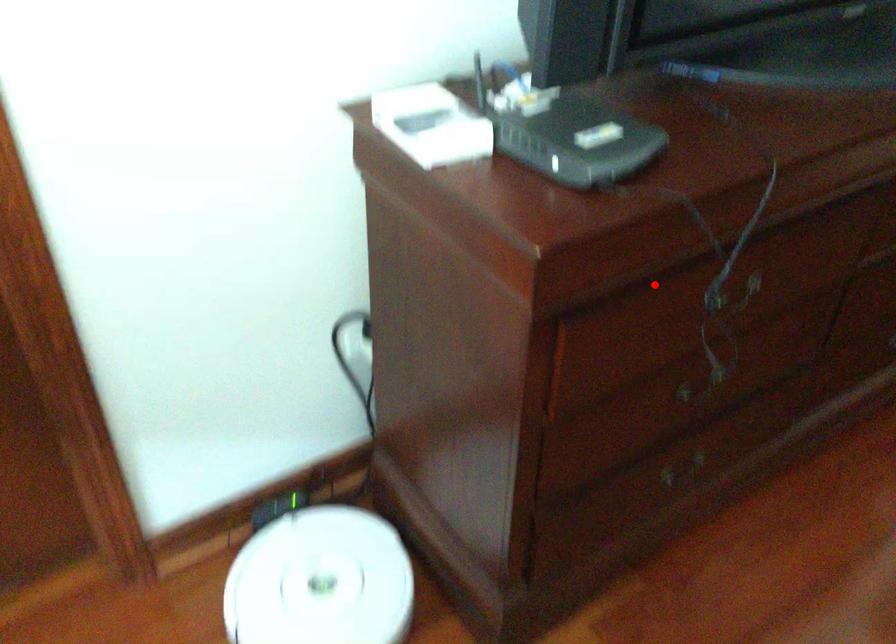
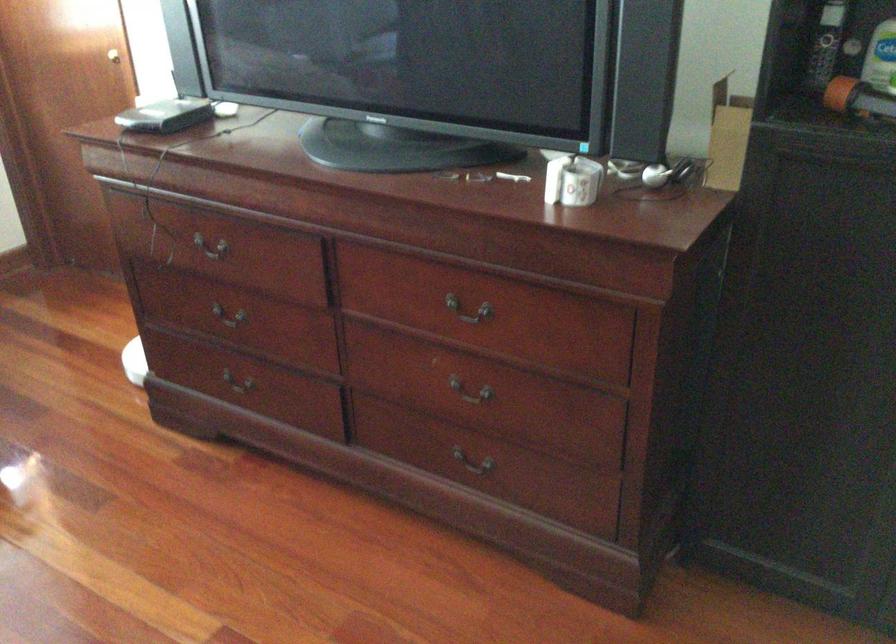
Where in the second image is the point corresponding to the highlighted location from the first image?

(211, 241)